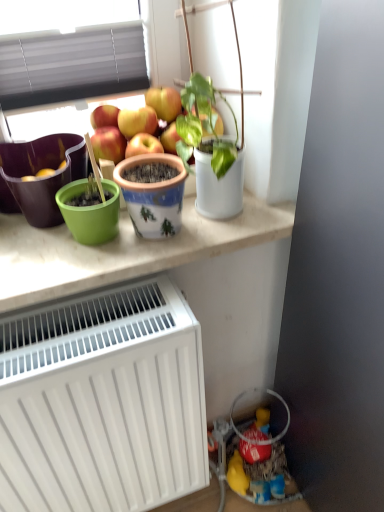
The width and height of the screenshot is (384, 512). What are the coordinates of `vacant area that is in front of white glossy pot at upper center` in the screenshot? It's located at (211, 240).